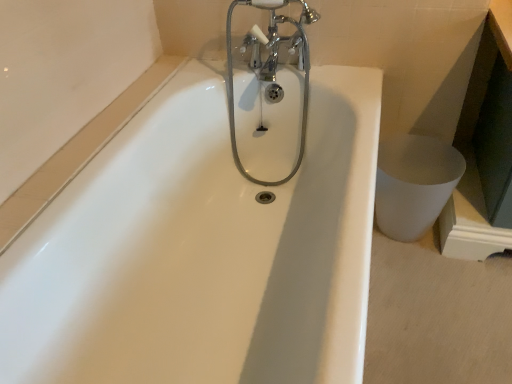
Question: Considering the relative sizes of white glossy toilet bowl at lower right and chrome metallic faucet at upper center in the image provided, is white glossy toilet bowl at lower right shorter than chrome metallic faucet at upper center?

Choices:
 (A) yes
 (B) no

Answer: (A)

Question: Can you see white glossy toilet bowl at lower right touching chrome metallic faucet at upper center?

Choices:
 (A) yes
 (B) no

Answer: (B)

Question: Is white glossy toilet bowl at lower right positioned behind chrome metallic faucet at upper center?

Choices:
 (A) yes
 (B) no

Answer: (A)

Question: Does white glossy toilet bowl at lower right appear on the left side of chrome metallic faucet at upper center?

Choices:
 (A) no
 (B) yes

Answer: (A)

Question: Is white glossy toilet bowl at lower right taller than chrome metallic faucet at upper center?

Choices:
 (A) no
 (B) yes

Answer: (A)

Question: From the image's perspective, does white glossy toilet bowl at lower right appear higher than chrome metallic faucet at upper center?

Choices:
 (A) no
 (B) yes

Answer: (A)

Question: Is chrome metallic faucet at upper center positioned behind white glossy toilet bowl at lower right?

Choices:
 (A) no
 (B) yes

Answer: (A)

Question: Considering the relative sizes of chrome metallic faucet at upper center and white glossy toilet bowl at lower right in the image provided, is chrome metallic faucet at upper center shorter than white glossy toilet bowl at lower right?

Choices:
 (A) yes
 (B) no

Answer: (B)

Question: Can you confirm if chrome metallic faucet at upper center is positioned to the left of white glossy toilet bowl at lower right?

Choices:
 (A) no
 (B) yes

Answer: (B)

Question: From a real-world perspective, is chrome metallic faucet at upper center over white glossy toilet bowl at lower right?

Choices:
 (A) yes
 (B) no

Answer: (A)

Question: From a real-world perspective, does chrome metallic faucet at upper center sit lower than white glossy toilet bowl at lower right?

Choices:
 (A) yes
 (B) no

Answer: (B)

Question: From the image's perspective, is chrome metallic faucet at upper center over white glossy toilet bowl at lower right?

Choices:
 (A) no
 (B) yes

Answer: (B)

Question: In the image, is white glossy toilet bowl at lower right on the left side or the right side of chrome metallic faucet at upper center?

Choices:
 (A) left
 (B) right

Answer: (B)